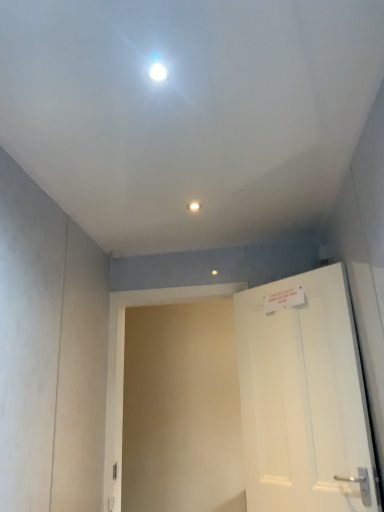
Question: From a real-world perspective, is white matte door at right above or below matte white light fixture at center?

Choices:
 (A) above
 (B) below

Answer: (B)

Question: From the image's perspective, is white matte door at right located above or below matte white light fixture at center?

Choices:
 (A) below
 (B) above

Answer: (A)

Question: In terms of width, does white matte door at right look wider or thinner when compared to matte white light fixture at center?

Choices:
 (A) wide
 (B) thin

Answer: (A)

Question: Based on their sizes in the image, would you say matte white light fixture at center is bigger or smaller than white matte door at right?

Choices:
 (A) big
 (B) small

Answer: (B)

Question: Is matte white light fixture at center in front of or behind white matte door at right in the image?

Choices:
 (A) behind
 (B) front

Answer: (A)

Question: Is matte white light fixture at center inside or outside of white matte door at right?

Choices:
 (A) outside
 (B) inside

Answer: (A)

Question: Looking at their shapes, would you say matte white light fixture at center is wider or thinner than white matte door at right?

Choices:
 (A) thin
 (B) wide

Answer: (A)